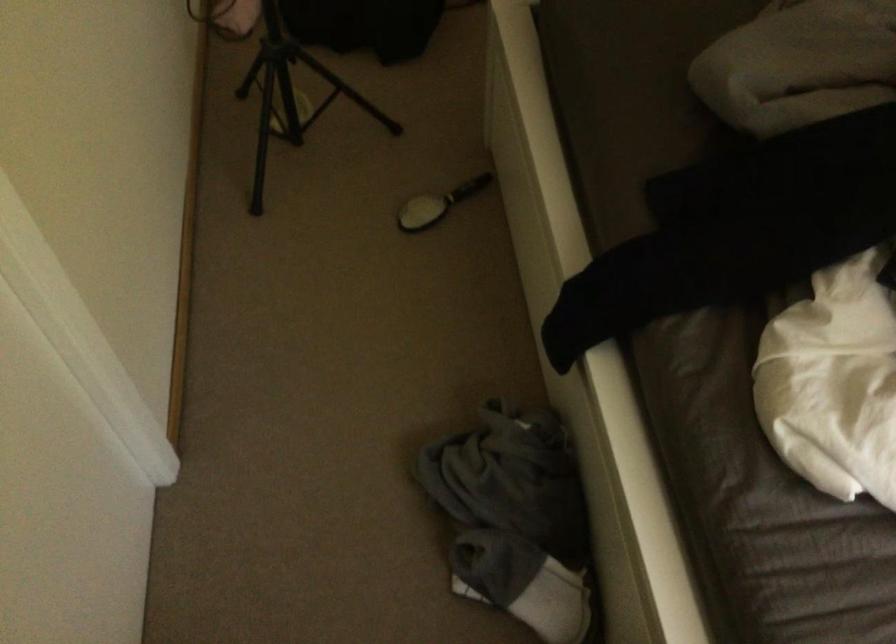
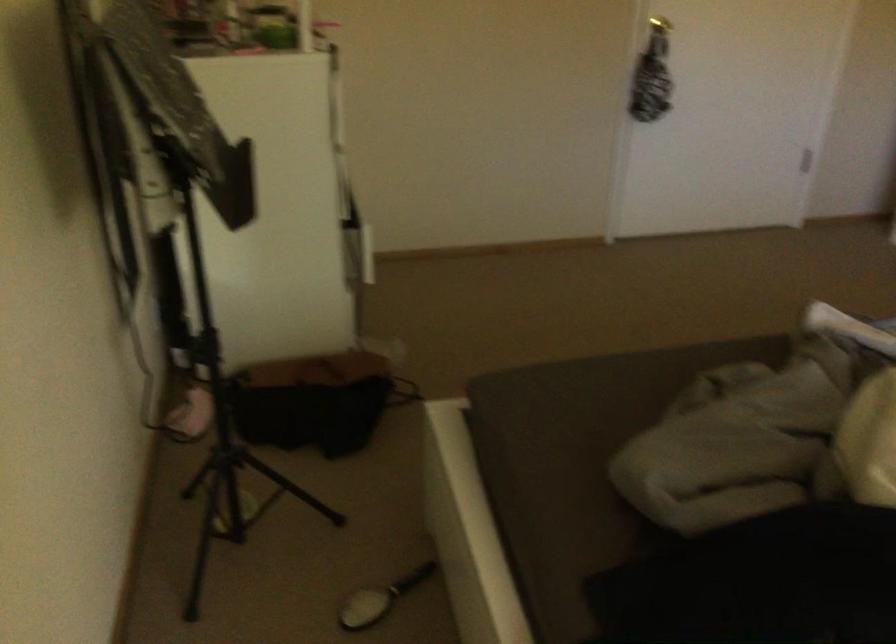
Question: How did the camera likely rotate?

Choices:
 (A) Left
 (B) Right
 (C) Up
 (D) Down

Answer: (C)